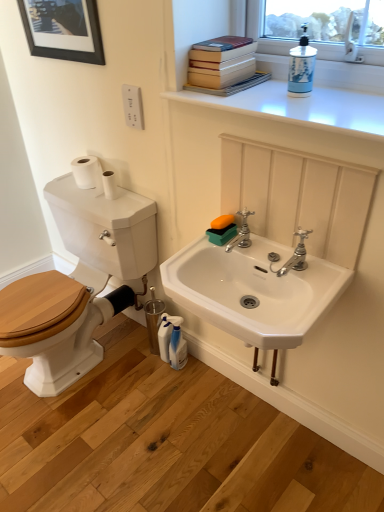
Question: Is white ceramic sink at center outside of white glossy counter top at upper center?

Choices:
 (A) yes
 (B) no

Answer: (A)

Question: From the image's perspective, is white ceramic sink at center on top of white glossy counter top at upper center?

Choices:
 (A) yes
 (B) no

Answer: (B)

Question: Can you confirm if white ceramic sink at center is smaller than white glossy counter top at upper center?

Choices:
 (A) yes
 (B) no

Answer: (B)

Question: Is white ceramic sink at center oriented towards white glossy counter top at upper center?

Choices:
 (A) no
 (B) yes

Answer: (A)

Question: Are white ceramic sink at center and white glossy counter top at upper center making contact?

Choices:
 (A) yes
 (B) no

Answer: (B)

Question: Considering the positions of white glossy soap dispenser at upper right, marked as the 2th cleaning product in a back-to-front arrangement, and white ceramic sink at center in the image, is white glossy soap dispenser at upper right, marked as the 2th cleaning product in a back-to-front arrangement, wider or thinner than white ceramic sink at center?

Choices:
 (A) thin
 (B) wide

Answer: (A)

Question: Considering their positions, is white glossy soap dispenser at upper right, marked as the 2th cleaning product in a back-to-front arrangement, located in front of or behind white ceramic sink at center?

Choices:
 (A) front
 (B) behind

Answer: (B)

Question: From a real-world perspective, is white glossy soap dispenser at upper right, the 2th cleaning product when ordered from bottom to top, above or below white ceramic sink at center?

Choices:
 (A) below
 (B) above

Answer: (B)

Question: Looking at the image, does white glossy soap dispenser at upper right, marked as the second cleaning product in a left-to-right arrangement, seem bigger or smaller compared to white ceramic sink at center?

Choices:
 (A) small
 (B) big

Answer: (A)

Question: From a real-world perspective, is white matte toilet paper at upper left positioned above or below white plastic spray bottle at lower center, the 2th cleaning product when ordered from right to left?

Choices:
 (A) above
 (B) below

Answer: (A)

Question: Considering the relative positions of white matte toilet paper at upper left and white plastic spray bottle at lower center, which ranks as the first cleaning product in bottom-to-top order, in the image provided, is white matte toilet paper at upper left to the left or to the right of white plastic spray bottle at lower center, which ranks as the first cleaning product in bottom-to-top order,?

Choices:
 (A) right
 (B) left

Answer: (B)

Question: Which is correct: white matte toilet paper at upper left is inside white plastic spray bottle at lower center, the 2th cleaning product from the top, or outside of it?

Choices:
 (A) outside
 (B) inside

Answer: (A)

Question: Considering the positions of point (109, 186) and point (175, 331), is point (109, 186) closer or farther from the camera than point (175, 331)?

Choices:
 (A) closer
 (B) farther

Answer: (A)

Question: Is hardcover books at upper right in front of or behind white glossy counter top at upper center in the image?

Choices:
 (A) front
 (B) behind

Answer: (B)

Question: Choose the correct answer: Is hardcover books at upper right inside white glossy counter top at upper center or outside it?

Choices:
 (A) inside
 (B) outside

Answer: (B)